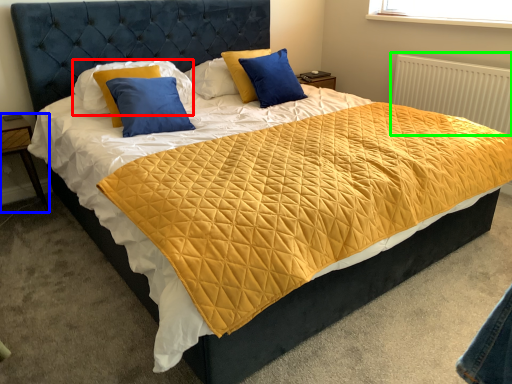
Question: Which object is the closest to the pillow (highlighted by a red box)? Choose among these: nightstand (highlighted by a blue box) or radiator (highlighted by a green box).

Choices:
 (A) nightstand
 (B) radiator

Answer: (A)